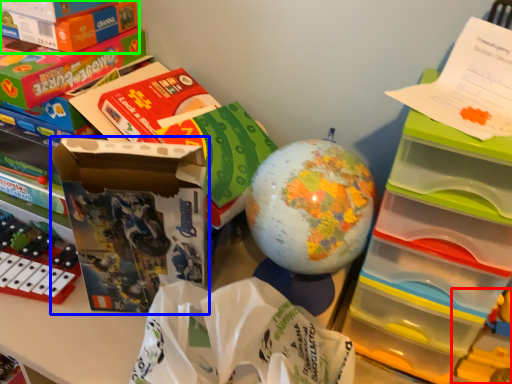
Question: Estimate the real-world distances between objects in this image. Which object is farther from toy (highlighted by a red box), storage box (highlighted by a blue box) or box (highlighted by a green box)?

Choices:
 (A) storage box
 (B) box

Answer: (B)